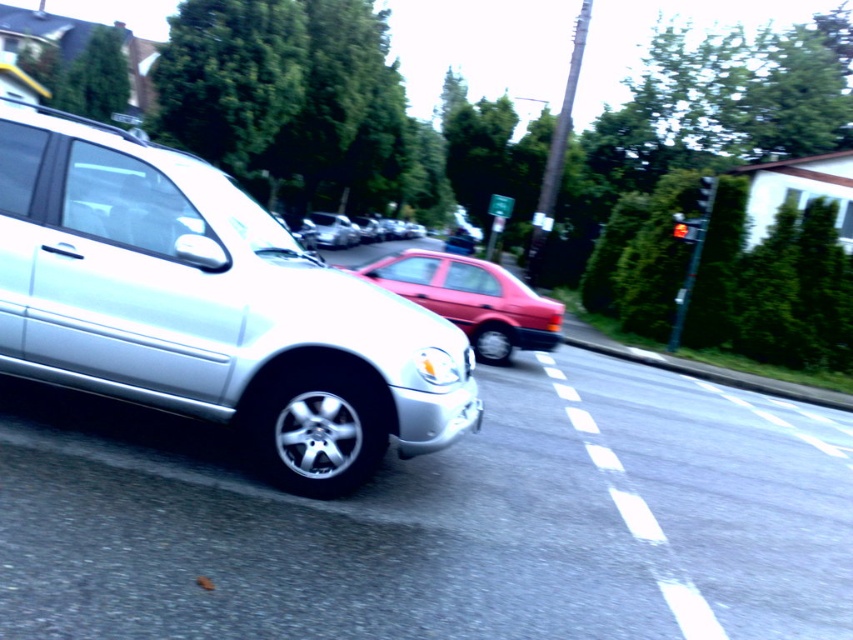
Question: Does matte red sedan at center appear on the left side of shiny silver sedan at center?

Choices:
 (A) yes
 (B) no

Answer: (B)

Question: Is satin silver minivan at left thinner than matte red sedan at center?

Choices:
 (A) yes
 (B) no

Answer: (A)

Question: Is satin silver minivan at left above shiny silver sedan at center?

Choices:
 (A) yes
 (B) no

Answer: (B)

Question: Which is nearer to the shiny silver sedan at center?

Choices:
 (A) satin silver minivan at left
 (B) matte red sedan at center

Answer: (B)

Question: Estimate the real-world distances between objects in this image. Which object is closer to the satin silver minivan at left?

Choices:
 (A) shiny silver sedan at center
 (B) matte red sedan at center

Answer: (B)

Question: Which of these objects is positioned farthest from the satin silver minivan at left?

Choices:
 (A) matte red sedan at center
 (B) shiny silver sedan at center

Answer: (B)